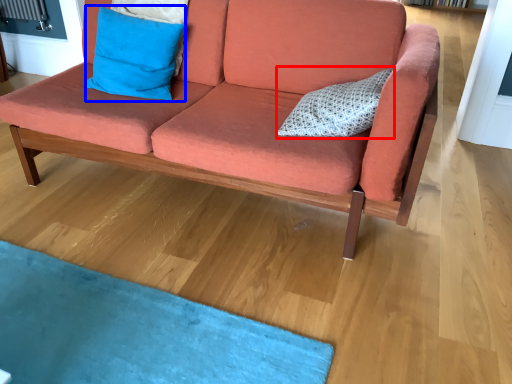
Question: Which point is closer to the camera, pillow (highlighted by a red box) or pillow (highlighted by a blue box)?

Choices:
 (A) pillow
 (B) pillow

Answer: (A)